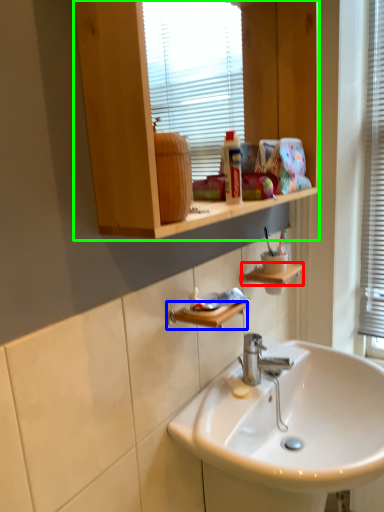
Question: Which is farther away from shelf (highlighted by a red box)? shelf (highlighted by a blue box) or cabinetry (highlighted by a green box)?

Choices:
 (A) shelf
 (B) cabinetry

Answer: (B)